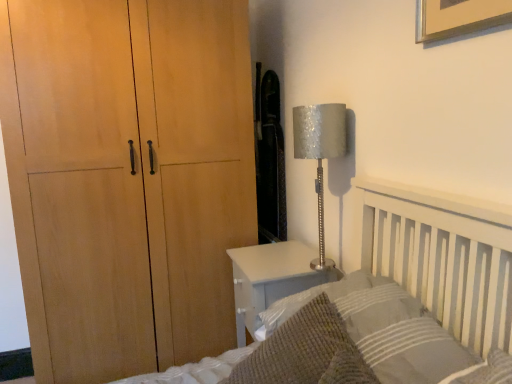
Locate an element on the screen. blank space above white glossy nightstand at lower right (from a real-world perspective) is located at coordinates (282, 251).